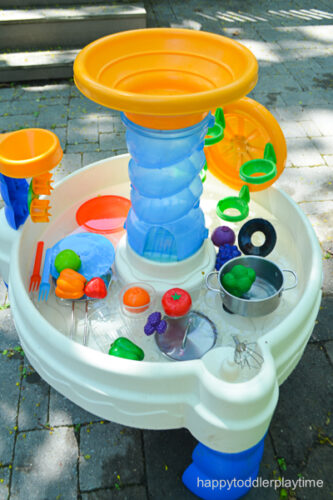
Locate an element on the screen. childrens toy is located at coordinates (166, 213).